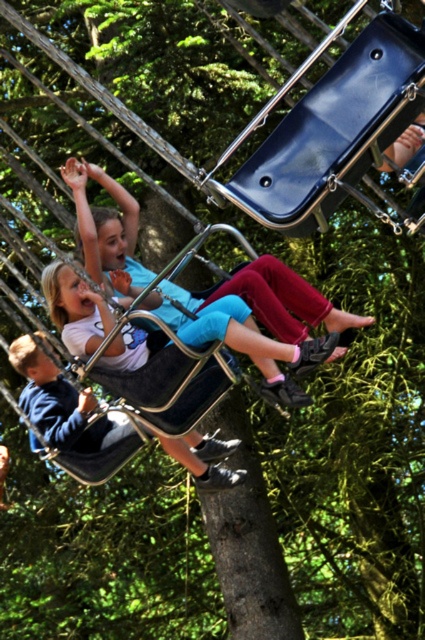
You are a photographer trying to capture a candid shot of the children on the swings. You notice the matte blue pants at center and the blue denim jeans at lower left. Which of these two items of clothing will appear smaller in your photo?

The matte blue pants at center will appear smaller in the photo because it occupies less space than the blue denim jeans at lower left.

You are a parent supervising children at the playground. You notice the matte black swing at lower left and the matte blue pants at center. Which object is located to the right of the other?

The matte black swing at lower left is positioned on the right side of matte blue pants at center, so the matte black swing at lower left is to the right of the matte blue pants at center.